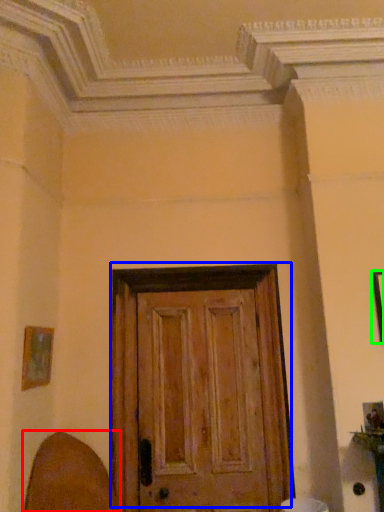
Question: Considering the real-world distances, which object is farthest from swivel chair (highlighted by a red box)? door (highlighted by a blue box) or picture frame (highlighted by a green box)?

Choices:
 (A) door
 (B) picture frame

Answer: (B)